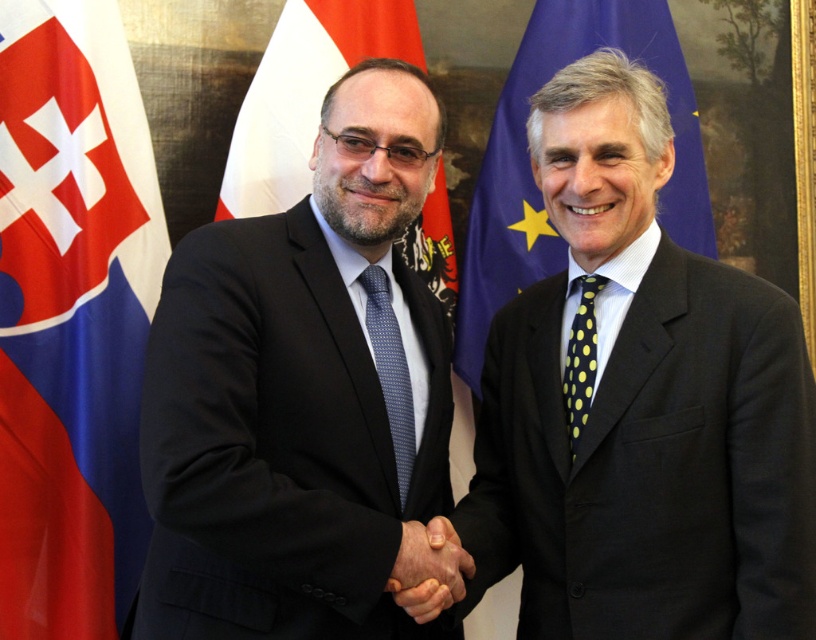
Based on the photo, can you confirm if dark gray suit at center is positioned below smooth skin handshake at center?

No, dark gray suit at center is not below smooth skin handshake at center.

Can you confirm if dark gray suit at center is positioned above smooth skin handshake at center?

Yes, dark gray suit at center is above smooth skin handshake at center.

Is point (583, 225) in front of point (428, 586)?

No.

Locate an element on the screen. The width and height of the screenshot is (816, 640). dark gray suit at center is located at coordinates (641, 406).

Can you confirm if dark gray suit at center is positioned to the right of blue dotted tie at center?

Indeed, dark gray suit at center is positioned on the right side of blue dotted tie at center.

Who is positioned more to the left, dark gray suit at center or blue dotted tie at center?

blue dotted tie at center

Locate an element on the screen. Image resolution: width=816 pixels, height=640 pixels. dark gray suit at center is located at coordinates (641, 406).

Which is behind, point (402, 580) or point (401, 417)?

Point (401, 417)

Is smooth skin handshake at center to the left of blue dotted tie at center from the viewer's perspective?

No, smooth skin handshake at center is not to the left of blue dotted tie at center.

Is point (438, 600) less distant than point (400, 442)?

Yes.

Where is `smooth skin handshake at center`? smooth skin handshake at center is located at coordinates (429, 568).